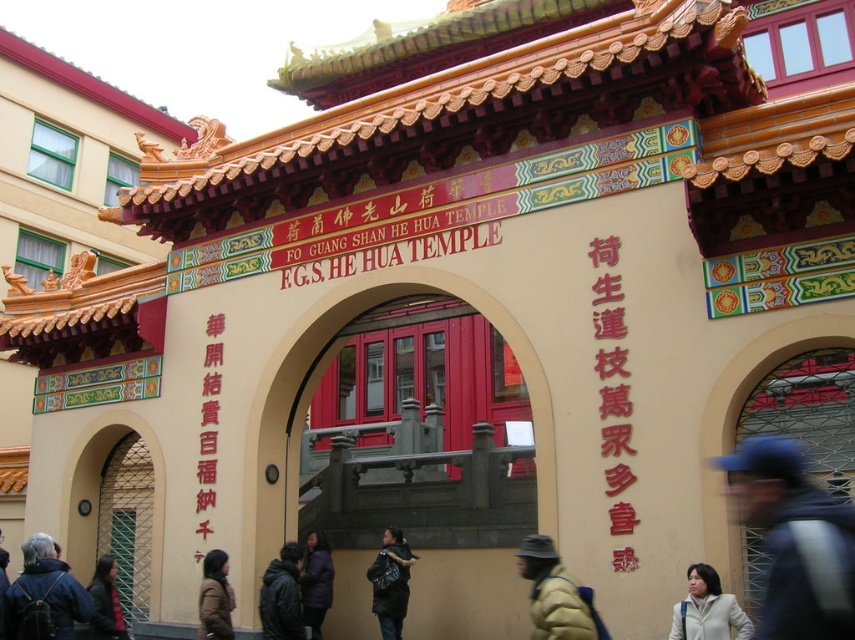
Question: Considering the real-world distances, which object is farthest from the yellow down jacket at lower center?

Choices:
 (A) black jacket at lower center
 (B) dark brown leather jacket at lower left

Answer: (B)

Question: Based on their relative distances, which object is farther from the red paper text at left?

Choices:
 (A) dark brown leather jacket at lower left
 (B) brown fuzzy coat at lower left
 (C) black jacket at lower center

Answer: (C)

Question: Which object is farther from the camera taking this photo?

Choices:
 (A) dark purple jacket at center
 (B) goldmaterial/texturesign at center
 (C) black jacket at lower center
 (D) red glossy text at center right

Answer: (A)

Question: Does red glossy text at center right appear over dark brown leather jacket at lower left?

Choices:
 (A) no
 (B) yes

Answer: (B)

Question: Is goldmaterial/texturesign at center smaller than black jacket at lower center?

Choices:
 (A) yes
 (B) no

Answer: (B)

Question: Where is blue fabric cap at upper right located in relation to black jacket at lower center in the image?

Choices:
 (A) left
 (B) right

Answer: (B)